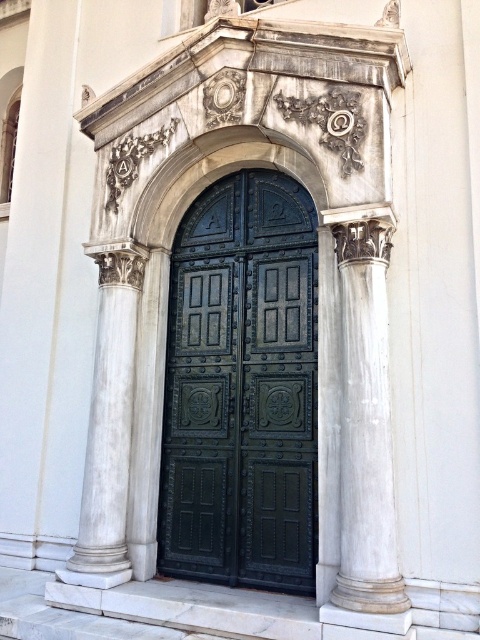
You are standing at the entrance of the building and want to take a photo. You notice two points marked in the scene. Which of the two points, point (x=397, y=609) or point (x=132, y=342), is closer to your camera lens?

Point (x=397, y=609) is closer to the camera lens than point (x=132, y=342).

You are an architect designing a new building entrance. You need to ensure that the green polished wood door at center and the white marble column at right will fit through a standard 1.2 meter wide doorway. Based on their widths, will both objects fit through the doorway when moved individually?

The green polished wood door at center might be wider than the white marble column at right. Since the doorway is 1.2 meters wide, the white marble column at right could fit through, but the green polished wood door at center might not if it exceeds 1.2 meters in width.